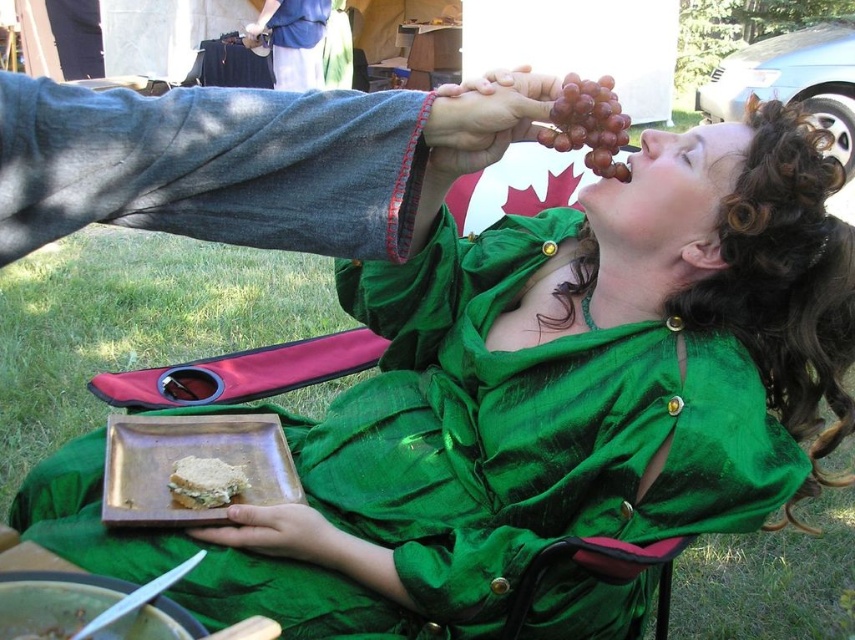
Question: Observing the image, what is the correct spatial positioning of ripe purple grapes at upper center in reference to crumbly white bread at lower left?

Choices:
 (A) below
 (B) above

Answer: (B)

Question: Is ripe purple grapes at upper center smaller than crumbly white bread at lower left?

Choices:
 (A) no
 (B) yes

Answer: (A)

Question: Which object appears farthest from the camera in this image?

Choices:
 (A) ripe purple grapes at upper center
 (B) crumbly white bread at lower left

Answer: (B)

Question: Among these points, which one is farthest from the camera?

Choices:
 (A) (211, 484)
 (B) (593, 120)

Answer: (A)

Question: Does ripe purple grapes at upper center have a greater width compared to crumbly white bread at lower left?

Choices:
 (A) yes
 (B) no

Answer: (A)